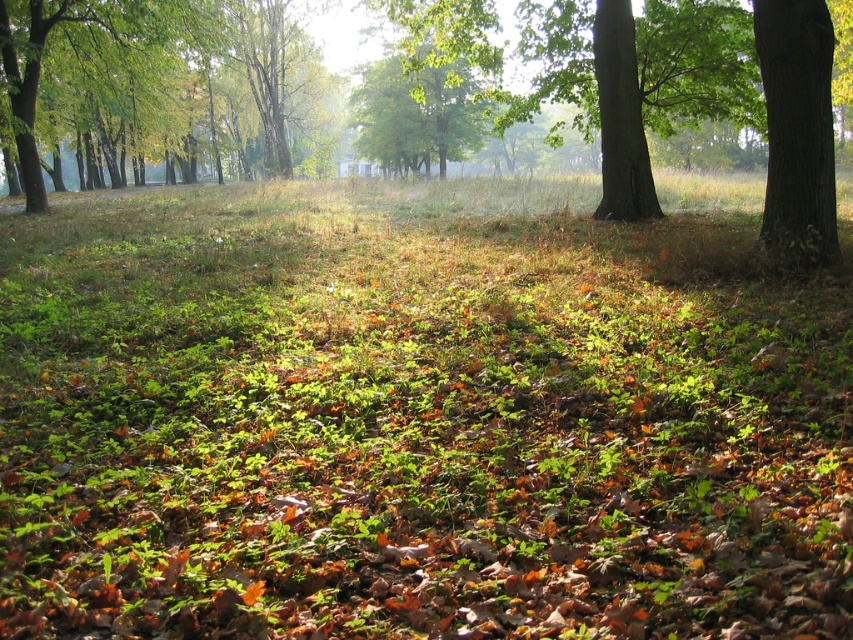
You are standing in the center of the forest. You want to locate the green rough bark tree at right. Which direction should you face to see it?

You should face the right direction to see the green rough bark tree at right, as it is located at point (798, 129).

You are a hiker standing in the forest and want to take a photo of both the green rough bark tree at right and the green leafy tree at left. However, you notice that one tree is blocking the view of the other. Which tree is blocking the other one?

The green rough bark tree at right is blocking the view of the green leafy tree at left because it is positioned in front of it.